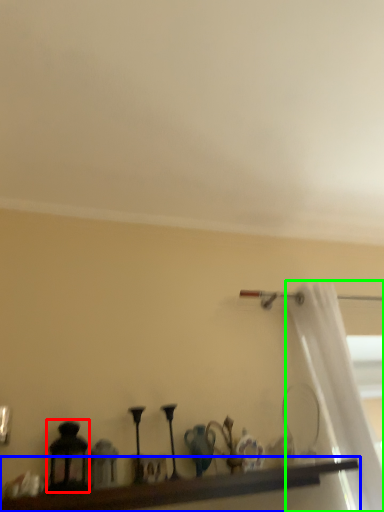
Question: Estimate the real-world distances between objects in this image. Which object is farther from candle holder (highlighted by a red box), shelf (highlighted by a blue box) or curtain (highlighted by a green box)?

Choices:
 (A) shelf
 (B) curtain

Answer: (B)